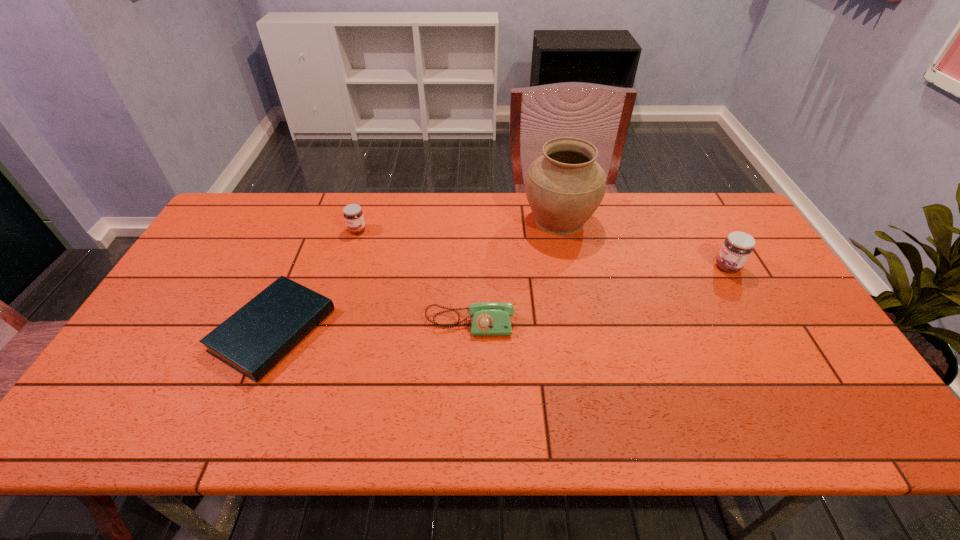
What are the coordinates of `vacant space that is in between the taller jam and the book` in the screenshot? It's located at (500, 298).

Where is `vacant area between the left jam and the second object from right to left`? vacant area between the left jam and the second object from right to left is located at coordinates (458, 225).

You are a GUI agent. You are given a task and a screenshot of the screen. Output one action in this format:
    pyautogui.click(x=<x>, y=<y>)
    Task: Click on the free space that is in between the taller jam and the farther jam
    
    Given the screenshot: What is the action you would take?
    pyautogui.click(x=542, y=248)

Identify which object is located as the third nearest to the urn. Please provide its 2D coordinates. Your answer should be formatted as a tuple, i.e. [(x, y)], where the tuple contains the x and y coordinates of a point satisfying the conditions above.

[(353, 215)]

Find the location of a particular element. This screenshot has height=540, width=960. object that is the third closest to the nearer jam is located at coordinates (353, 215).

This screenshot has width=960, height=540. What are the coordinates of `free space that satisfies the following two spatial constraints: 1. on the back side of the third shortest object; 2. on the left side of the tallest object` in the screenshot? It's located at (360, 220).